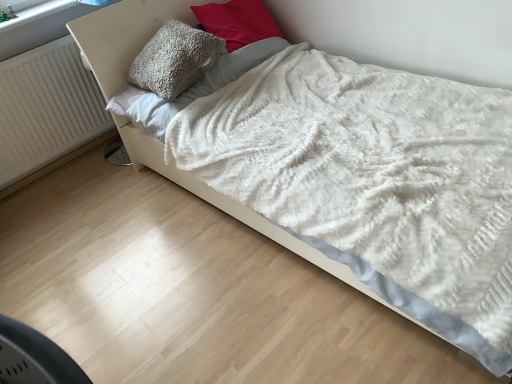
Question: From their relative heights in the image, would you say white fluffy sheet at upper center is taller or shorter than fluffy gray pillow at upper center, positioned as the 1th pillow in left-to-right order?

Choices:
 (A) short
 (B) tall

Answer: (A)

Question: Is white fluffy sheet at upper center bigger or smaller than fluffy gray pillow at upper center, positioned as the 1th pillow in left-to-right order?

Choices:
 (A) big
 (B) small

Answer: (B)

Question: Which of these objects is positioned closest to the white ribbed radiator at left?

Choices:
 (A) white plastic window frame at upper left
 (B) fuzzy gray pillow at upper center, which is the second pillow in left-to-right order
 (C) white fluffy sheet at upper center
 (D) fluffy gray pillow at upper center, positioned as the 1th pillow in left-to-right order

Answer: (A)

Question: Which of these objects is positioned farthest from the white ribbed radiator at left?

Choices:
 (A) white fluffy sheet at upper center
 (B) white plastic window frame at upper left
 (C) fluffy gray pillow at upper center, positioned as the 1th pillow in left-to-right order
 (D) fuzzy gray pillow at upper center, which is the second pillow in left-to-right order

Answer: (D)